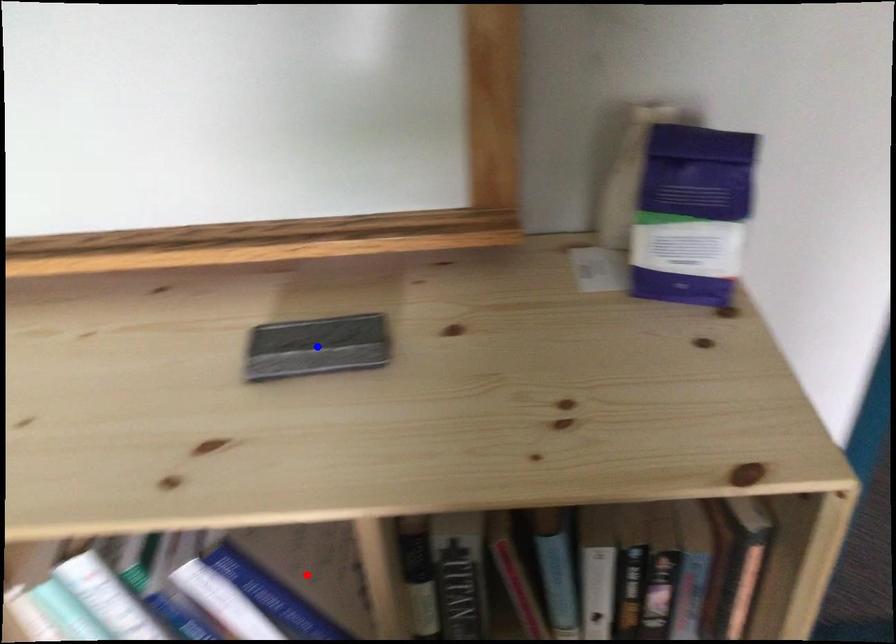
Question: Two points are marked on the image. Which point is closer to the camera?

Choices:
 (A) Blue point is closer.
 (B) Red point is closer.

Answer: (A)